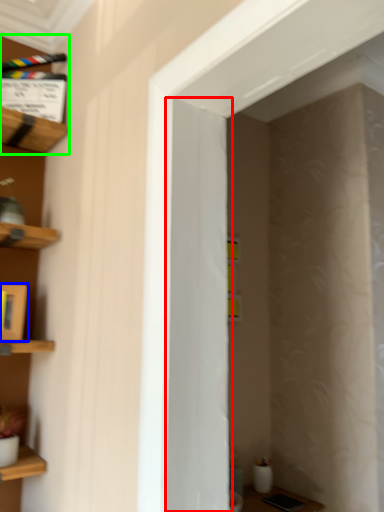
Question: Estimate the real-world distances between objects in this image. Which object is farther from door (highlighted by a red box), cabinet (highlighted by a blue box) or shelf (highlighted by a green box)?

Choices:
 (A) cabinet
 (B) shelf

Answer: (B)